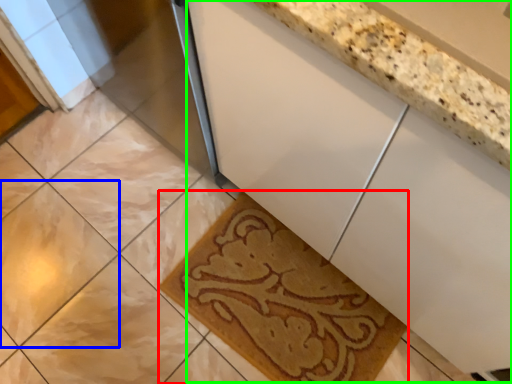
Question: Estimate the real-world distances between objects in this image. Which object is farther from bath mat (highlighted by a red box), ceramic tile (highlighted by a blue box) or counter (highlighted by a green box)?

Choices:
 (A) ceramic tile
 (B) counter

Answer: (A)